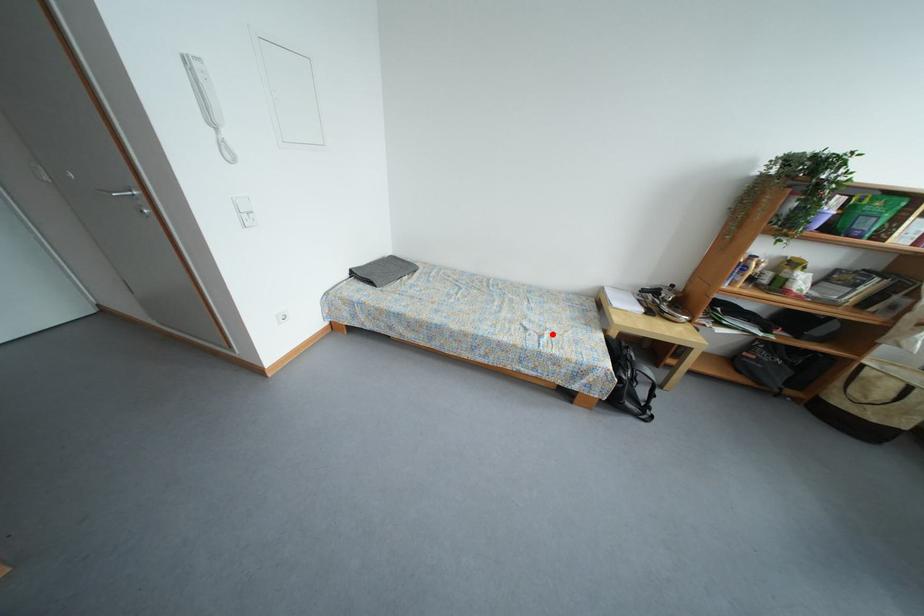
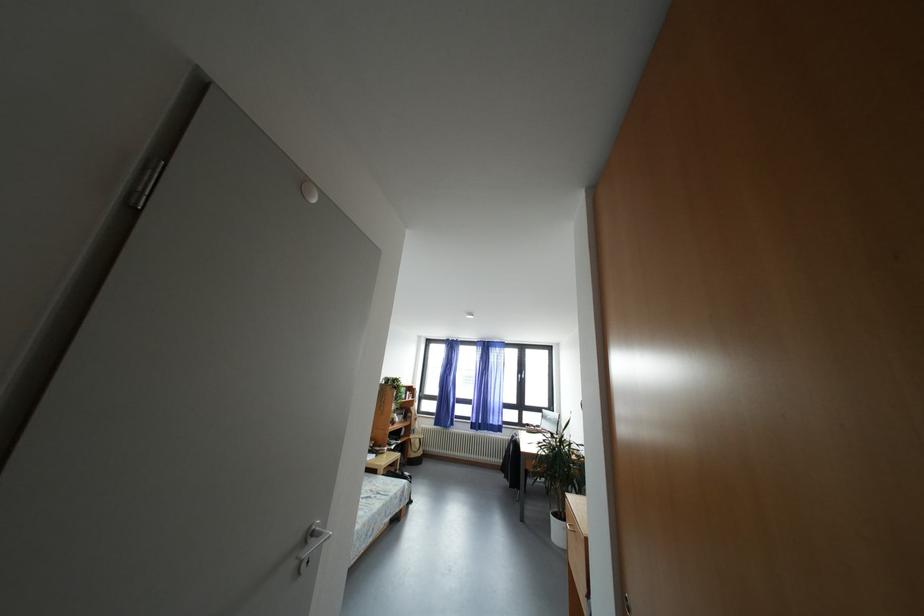
Locate, in the second image, the point that corresponds to the highlighted location in the first image.

(378, 496)